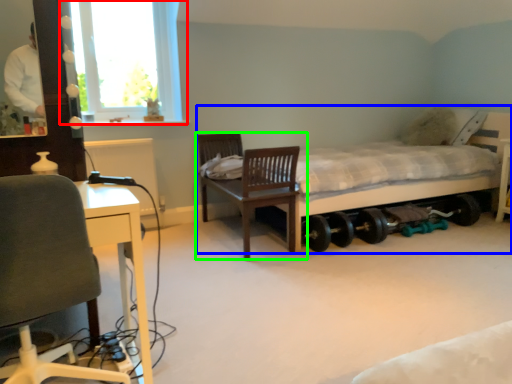
Question: Based on their relative distances, which object is nearer to window (highlighted by a red box)? Choose from bed (highlighted by a blue box) and chair (highlighted by a green box).

Choices:
 (A) bed
 (B) chair

Answer: (B)